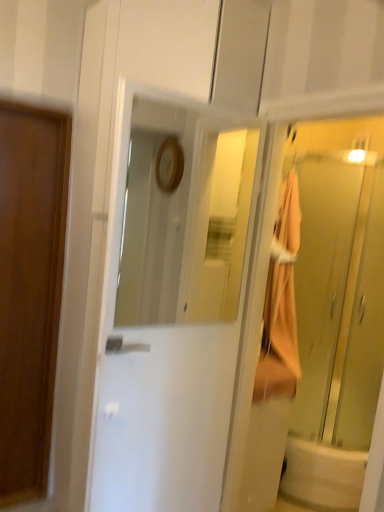
Question: From the image's perspective, is wooden door at left, which ranks as the 1th door in left-to-right order, above or below translucent glass elevator at right?

Choices:
 (A) below
 (B) above

Answer: (A)

Question: From a real-world perspective, is wooden door at left, which appears as the 1th door when viewed from the back, physically located above or below translucent glass elevator at right?

Choices:
 (A) above
 (B) below

Answer: (B)

Question: Estimate the real-world distances between objects in this image. Which object is farther from the white glossy bathtub at lower right?

Choices:
 (A) white glossy door at center, placed as the 2th door when sorted from left to right
 (B) translucent glass elevator at right
 (C) wooden door at left, which is the second door from front to back

Answer: (C)

Question: Which is nearer to the wooden door at left, which ranks as the 1th door in left-to-right order?

Choices:
 (A) white glossy door at center, placed as the 2th door when sorted from left to right
 (B) translucent glass elevator at right
 (C) white glossy bathtub at lower right

Answer: (A)